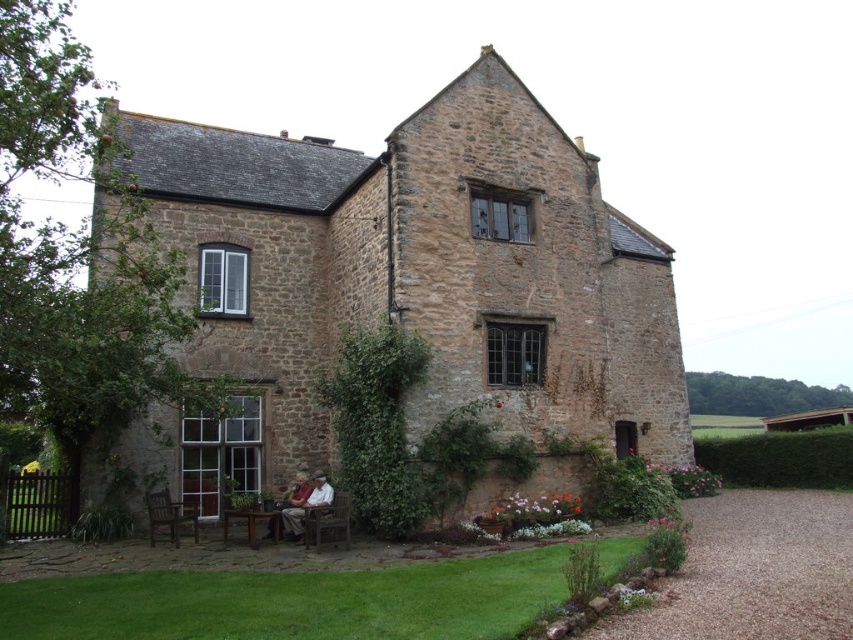
Does green grass at lower center appear on the left side of matte brown jacket at lower center?

In fact, green grass at lower center is to the right of matte brown jacket at lower center.

Identify the location of green grass at lower center. The image size is (853, 640). (294, 602).

Identify the location of green grass at lower center. (294, 602).

In the scene shown: Is brown wooden park bench at lower center wider than matte brown jacket at lower center?

No.

Does point (270, 513) come in front of point (271, 525)?

Yes, point (270, 513) is in front of point (271, 525).

At what (x,y) coordinates should I click in order to perform the action: click on brown wooden park bench at lower center. Please return your answer as a coordinate pair (x, y). This screenshot has width=853, height=640. Looking at the image, I should click on (252, 524).

Which of these two, green grass at lower center or white textured shirt at center, stands taller?

Standing taller between the two is green grass at lower center.

Is green grass at lower center wider than white textured shirt at center?

Correct, the width of green grass at lower center exceeds that of white textured shirt at center.

Is point (143, 586) farther from viewer compared to point (294, 518)?

No.

Locate an element on the screen. Image resolution: width=853 pixels, height=640 pixels. green grass at lower center is located at coordinates (294, 602).